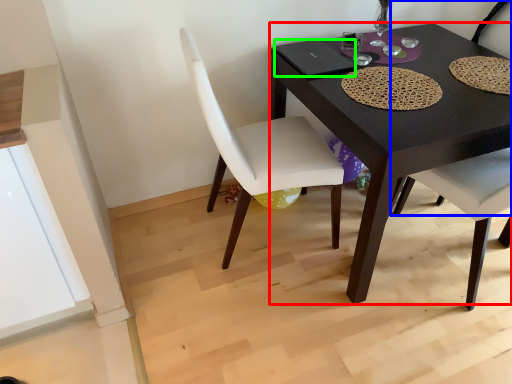
Question: Which object is positioned farthest from desk (highlighted by a red box)? Select from chair (highlighted by a blue box) and laptop (highlighted by a green box).

Choices:
 (A) chair
 (B) laptop

Answer: (A)